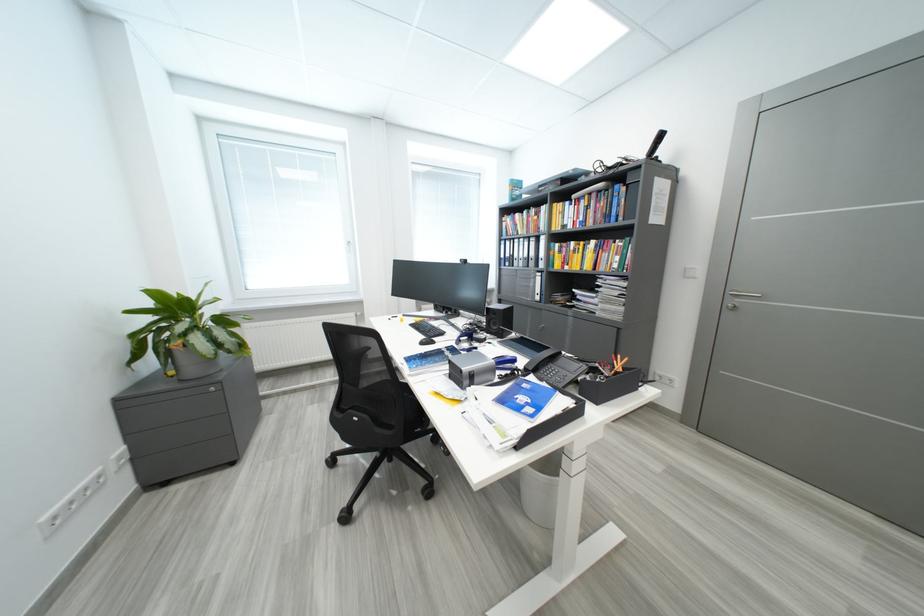
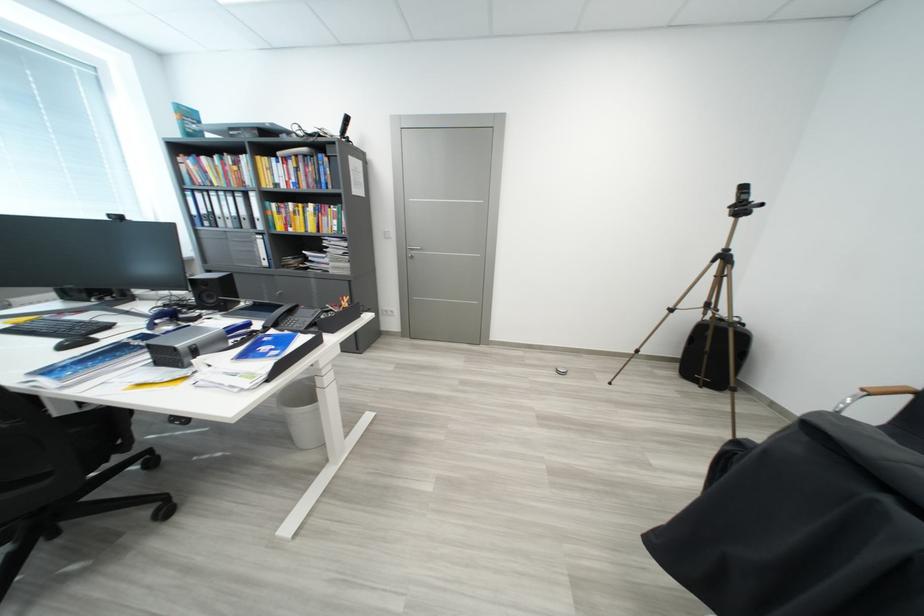
Locate, in the second image, the point that corresponds to pixel 504 326 in the first image.

(220, 300)